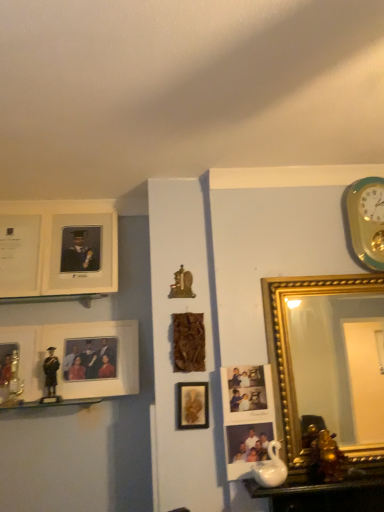
Question: Considering the relative sizes of teal-golden wall clock at upper right and matte plastic photo frame at center, which is the eighth picture frame in left-to-right order, in the image provided, is teal-golden wall clock at upper right wider than matte plastic photo frame at center, which is the eighth picture frame in left-to-right order,?

Choices:
 (A) no
 (B) yes

Answer: (B)

Question: Is the depth of teal-golden wall clock at upper right greater than that of matte plastic photo frame at center, arranged as the 2th picture frame when viewed from the right?

Choices:
 (A) yes
 (B) no

Answer: (A)

Question: Is teal-golden wall clock at upper right looking in the opposite direction of matte plastic photo frame at center, which is the eighth picture frame in left-to-right order?

Choices:
 (A) yes
 (B) no

Answer: (B)

Question: Does teal-golden wall clock at upper right contain matte plastic photo frame at center, which is the eighth picture frame in left-to-right order?

Choices:
 (A) no
 (B) yes

Answer: (A)

Question: Can you confirm if teal-golden wall clock at upper right is taller than matte plastic photo frame at center, which is the eighth picture frame in left-to-right order?

Choices:
 (A) no
 (B) yes

Answer: (B)

Question: Would you consider teal-golden wall clock at upper right to be distant from matte plastic photo frame at center, which is the eighth picture frame in left-to-right order?

Choices:
 (A) no
 (B) yes

Answer: (A)

Question: Is white glossy table at lower right closer to the viewer compared to matte plastic photo frame at center, arranged as the 2th picture frame when viewed from the right?

Choices:
 (A) yes
 (B) no

Answer: (A)

Question: Is white glossy table at lower right smaller than matte plastic photo frame at center, which is the eighth picture frame in left-to-right order?

Choices:
 (A) no
 (B) yes

Answer: (A)

Question: From a real-world perspective, is white glossy table at lower right positioned under matte plastic photo frame at center, which is the eighth picture frame in left-to-right order, based on gravity?

Choices:
 (A) yes
 (B) no

Answer: (A)

Question: Is white glossy table at lower right wider than matte plastic photo frame at center, arranged as the 2th picture frame when viewed from the right?

Choices:
 (A) no
 (B) yes

Answer: (B)

Question: Is white glossy table at lower right oriented towards matte plastic photo frame at center, which is the eighth picture frame in left-to-right order?

Choices:
 (A) no
 (B) yes

Answer: (A)

Question: Can you confirm if white glossy table at lower right is taller than matte plastic photo frame at center, arranged as the 2th picture frame when viewed from the right?

Choices:
 (A) yes
 (B) no

Answer: (B)

Question: Is white matte picture frame at upper left, the first picture frame positioned from the left, located outside matte white picture frame at left, the 5th picture frame from the right?

Choices:
 (A) yes
 (B) no

Answer: (A)